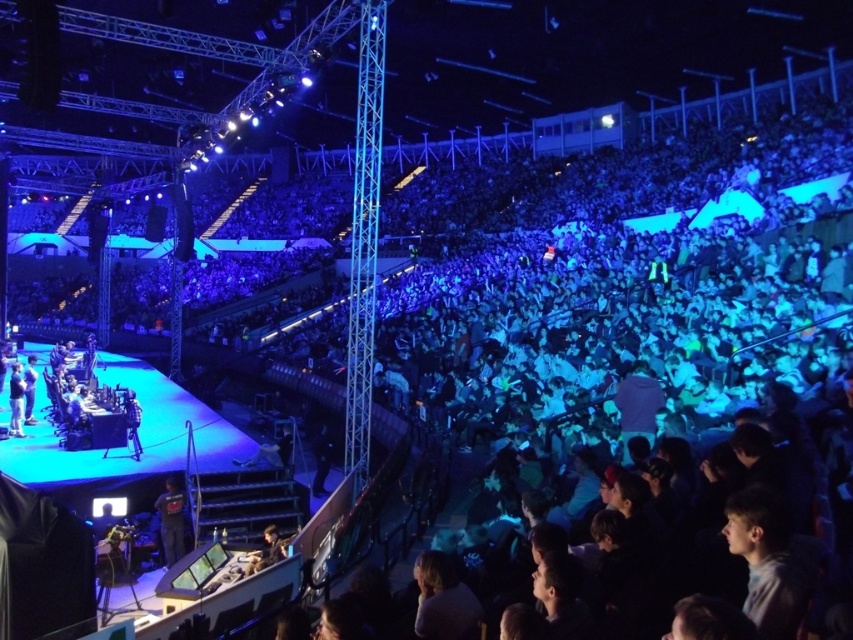
Consider the image. You are standing at the entrance of the arena and want to locate the person wearing the dark gray hoodie at center. According to the coordinate system where the bottom left corner is the origin, can you estimate where to look?

The dark gray hoodie at center is located at coordinates approximately 81.4 percent along the horizontal axis and 20.2 percent along the vertical axis from the bottom left corner.

You are standing at the back of the arena and want to move towards the stage. There are two points marked in the arena, point (175, 522) and point (9, 419). Which point should you head towards to get closer to the stage?

You should head towards point (175, 522) because it is closer to the viewer, meaning it is nearer to the stage compared to point (9, 419).

You are a photographer standing at the back of the arena. You want to take a photo of the dark blue fabric jacket at lower center and the dark gray fabric jacket at stage left. Can you capture both in a single frame without moving your camera? Explain your reasoning based on their distance apart.

The dark blue fabric jacket at lower center and the dark gray fabric jacket at stage left are 18.93 meters apart. Depending on the camera lens and field of view, capturing both in a single frame may be possible if the lens has a wide enough angle to encompass the entire 18.93 meter distance between them. However, at such a large distance, it might be challenging to clearly see the details of both jackets in the photo.